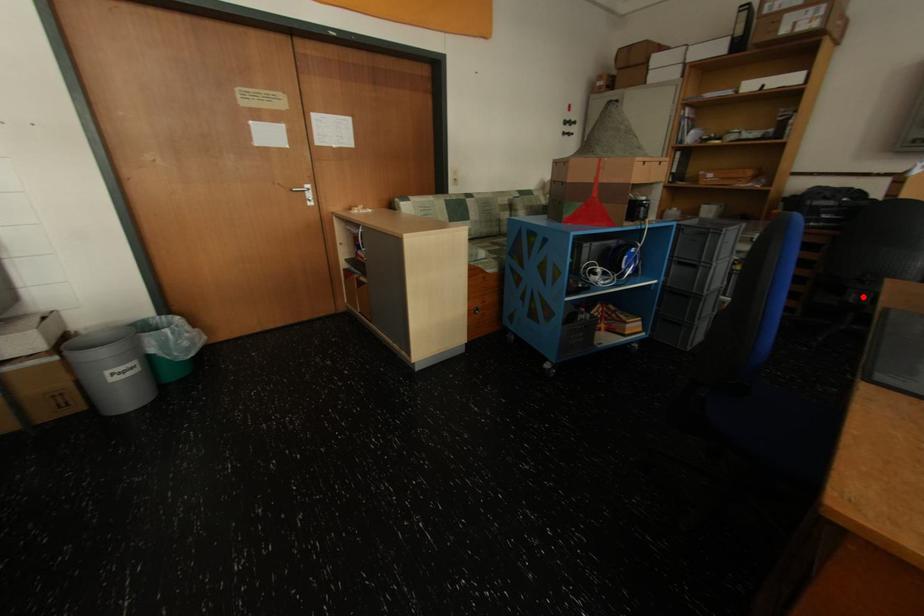
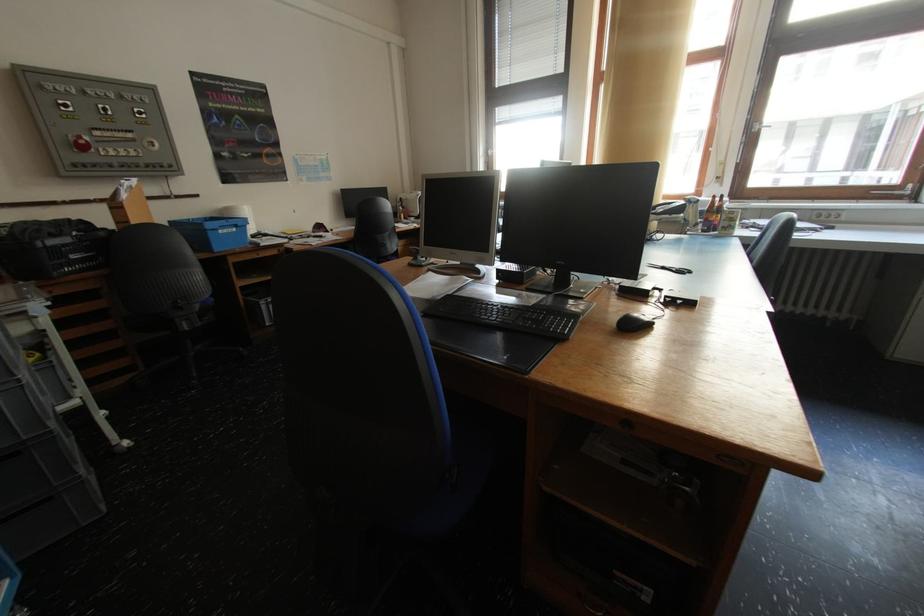
Question: I am providing you with two images of the same scene from different viewpoints. In image1, a red point is highlighted. Considering the same 3D point in image2, which of the following is correct?

Choices:
 (A) It is closer
 (B) It is farther

Answer: (A)